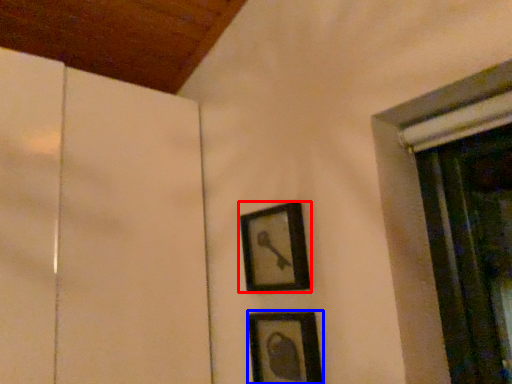
Question: Which object is further to the camera taking this photo, picture frame (highlighted by a red box) or picture frame (highlighted by a blue box)?

Choices:
 (A) picture frame
 (B) picture frame

Answer: (A)